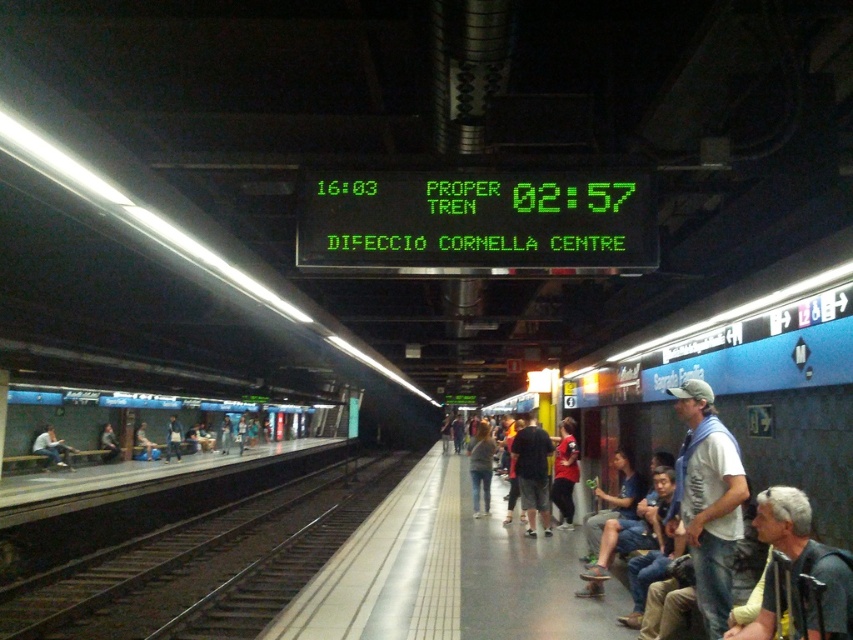
Based on the photo, is blue glossy bench at left to the left of denim jeans at right from the viewer's perspective?

Indeed, blue glossy bench at left is positioned on the left side of denim jeans at right.

Measure the distance between blue glossy bench at left and denim jeans at right.

79.54 feet

Is point (90, 435) farther from camera compared to point (709, 394)?

That is True.

This screenshot has height=640, width=853. Identify the location of blue glossy bench at left. (140, 426).

Is denim jeans at right shorter than light blue jeans at platform left?

No, denim jeans at right is not shorter than light blue jeans at platform left.

Between point (705, 538) and point (53, 454), which one is positioned in front?

Point (705, 538) is in front.

Does point (682, 406) come farther from viewer compared to point (51, 460)?

No, (682, 406) is in front of (51, 460).

At what (x,y) coordinates should I click in order to perform the action: click on denim jeans at right. Please return your answer as a coordinate pair (x, y). Looking at the image, I should click on (708, 499).

Does black metal train track at lower left have a greater width compared to light blue jeans at platform left?

Correct, the width of black metal train track at lower left exceeds that of light blue jeans at platform left.

Who is higher up, black metal train track at lower left or light blue jeans at platform left?

light blue jeans at platform left is higher up.

At what (x,y) coordinates should I click in order to perform the action: click on black metal train track at lower left. Please return your answer as a coordinate pair (x, y). This screenshot has height=640, width=853. Looking at the image, I should click on click(x=204, y=563).